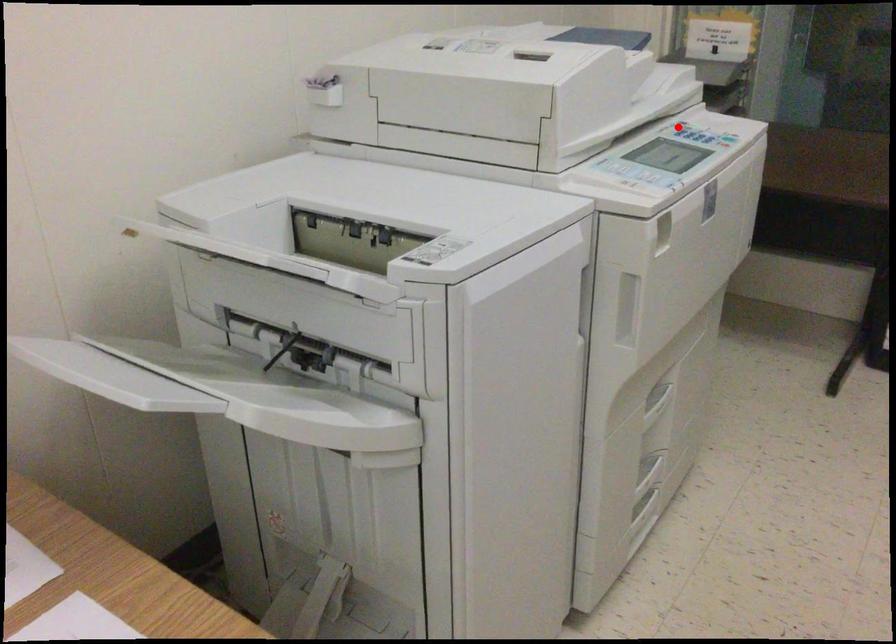
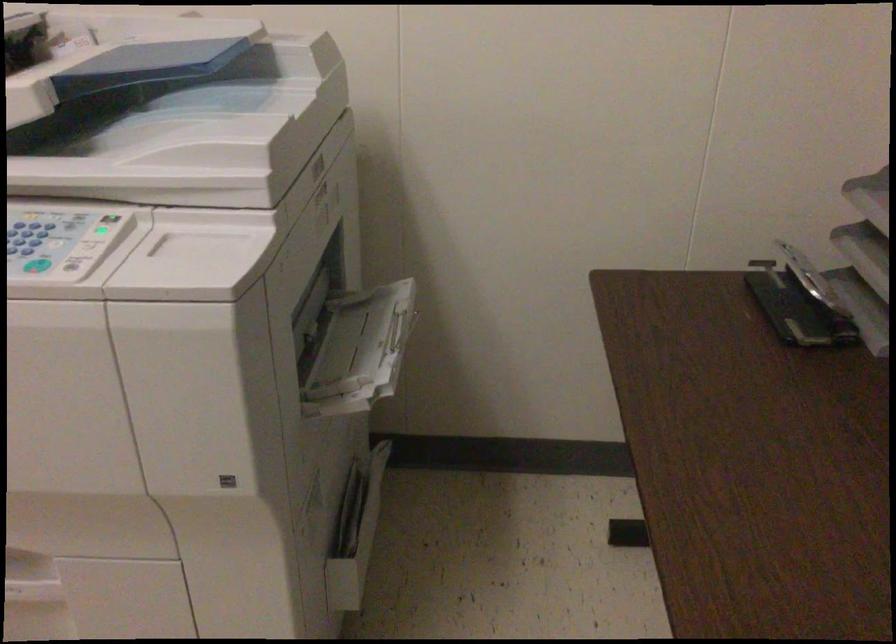
Where in the second image is the point corresponding to the highlighted location from the first image?

(107, 228)